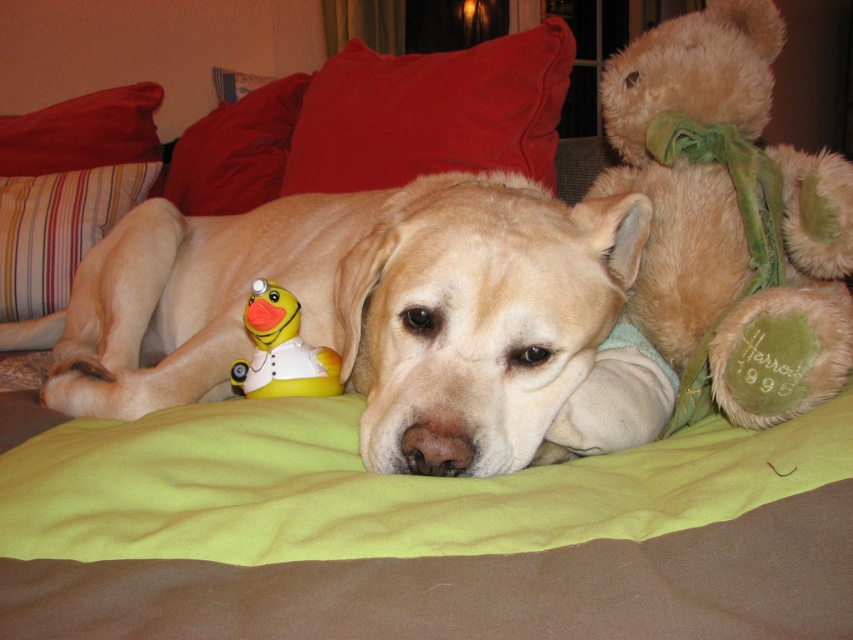
Is golden fur dog at center positioned at the back of velvety red pillow at upper left?

No, golden fur dog at center is in front of velvety red pillow at upper left.

Is golden fur dog at center thinner than velvety red pillow at upper left?

No.

Locate an element on the screen. The width and height of the screenshot is (853, 640). golden fur dog at center is located at coordinates (361, 308).

Does point (440, 118) come farther from viewer compared to point (204, 193)?

No, (440, 118) is in front of (204, 193).

Which is in front, point (438, 67) or point (254, 173)?

Point (438, 67)

Identify the location of red velvet pillow at upper center. The height and width of the screenshot is (640, 853). (432, 113).

Does point (84, 241) lie behind point (79, 129)?

No, it is not.

Is striped fabric pillow at left thinner than red cotton pillow at upper left?

Yes, striped fabric pillow at left is thinner than red cotton pillow at upper left.

Between point (136, 179) and point (135, 152), which one is positioned in front?

Point (136, 179)

Where is `striped fabric pillow at left`? This screenshot has height=640, width=853. striped fabric pillow at left is located at coordinates (57, 228).